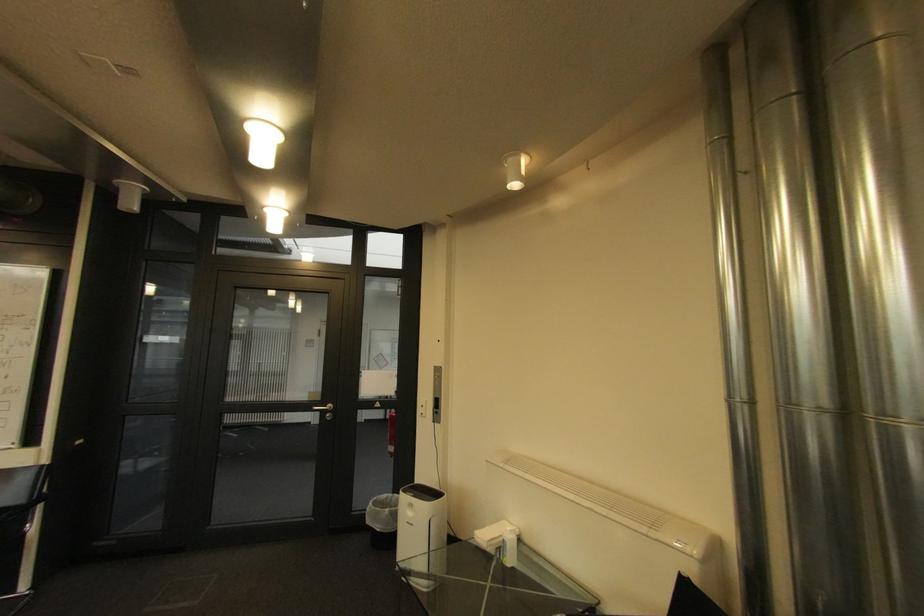
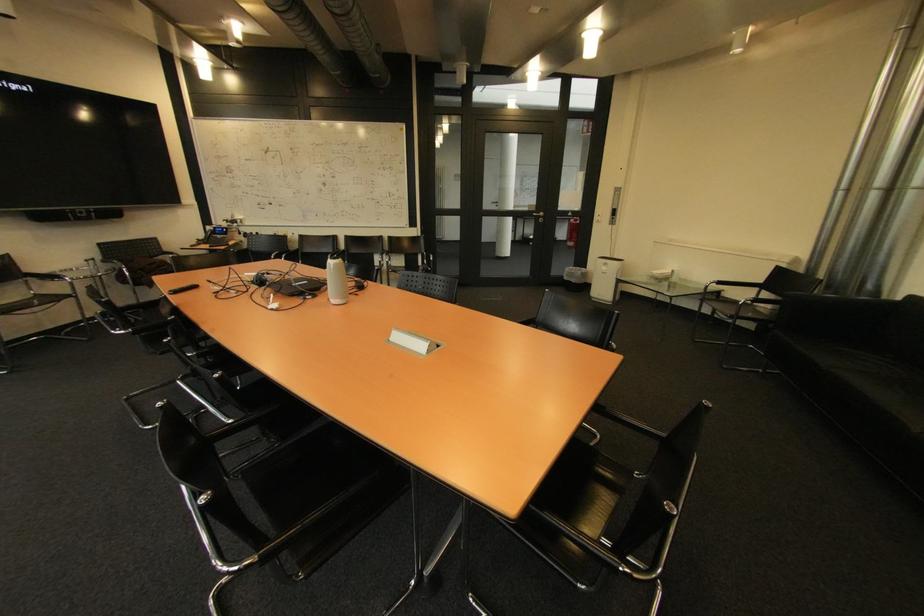
Locate, in the second image, the point that corresponds to (x=418, y=515) in the first image.

(613, 270)